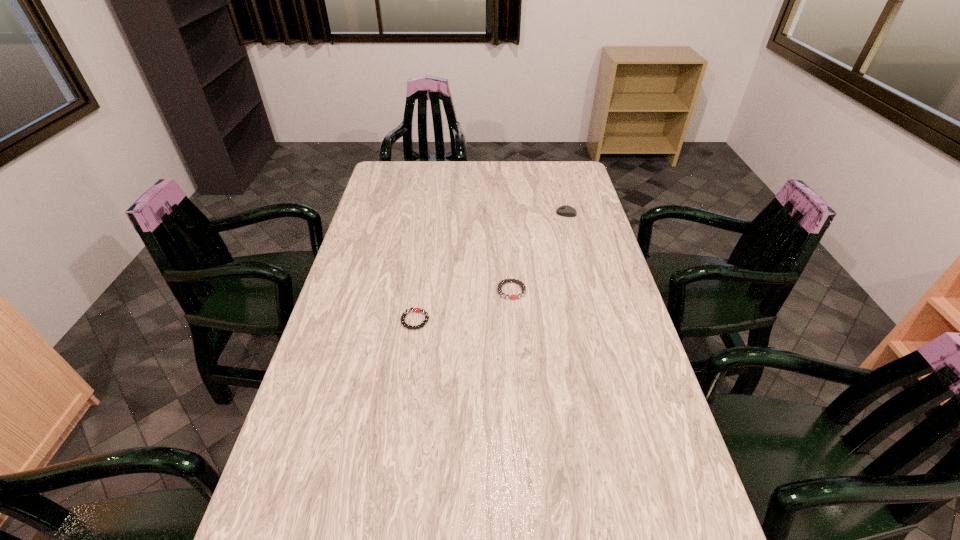
I want to click on free space at the far edge of the desktop, so click(x=519, y=187).

Locate an element on the screen. blank space at the left edge is located at coordinates (357, 299).

The height and width of the screenshot is (540, 960). In the image, there is a desktop. Identify the location of free space at the right edge. pos(644,523).

Find the location of a particular element. The image size is (960, 540). vacant area at the far right corner is located at coordinates [x=570, y=175].

You are a GUI agent. You are given a task and a screenshot of the screen. Output one action in this format:
    pyautogui.click(x=<x>, y=<y>)
    Task: Click on the vacant space in between the tallest object and the nearest object
    
    Given the screenshot: What is the action you would take?
    pyautogui.click(x=491, y=267)

Locate an element on the screen. This screenshot has width=960, height=540. vacant area that lies between the farthest object and the second object from right to left is located at coordinates (539, 252).

Identify the location of vacant area between the second object from left to right and the tallest object. The image size is (960, 540). (539, 252).

Locate an element on the screen. The width and height of the screenshot is (960, 540). free spot between the nearer bracelet and the rightmost object is located at coordinates (491, 267).

Where is `free spot between the nearest object and the second nearest object`? This screenshot has height=540, width=960. free spot between the nearest object and the second nearest object is located at coordinates (464, 305).

Find the location of a particular element. This screenshot has height=540, width=960. vacant area between the right bracelet and the nearer bracelet is located at coordinates (464, 305).